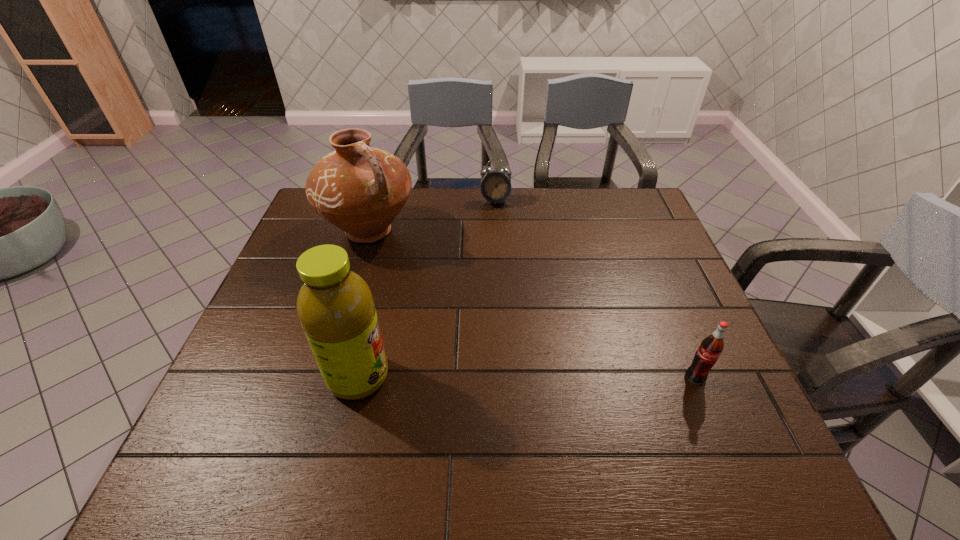
Locate an element on the screen. fruit juice is located at coordinates (335, 306).

Identify the location of the third tallest object. Image resolution: width=960 pixels, height=540 pixels. click(706, 356).

Identify the location of soda bottle. The width and height of the screenshot is (960, 540). (706, 356).

Locate an element on the screen. This screenshot has width=960, height=540. alarm clock is located at coordinates (495, 187).

Identify the location of the shortest object. This screenshot has height=540, width=960. (495, 187).

Find the location of `pottery`. pottery is located at coordinates (360, 189).

Where is `vacant space located on the front label of the fruit juice`? vacant space located on the front label of the fruit juice is located at coordinates (501, 377).

Locate an element on the screen. free point located 0.060m on the label of the rightmost object is located at coordinates (708, 409).

Image resolution: width=960 pixels, height=540 pixels. Find the location of `free space located on the face of the second object from right to left`. free space located on the face of the second object from right to left is located at coordinates (498, 290).

The image size is (960, 540). Identify the location of blank space located 0.140m on the face of the second object from right to left. (496, 234).